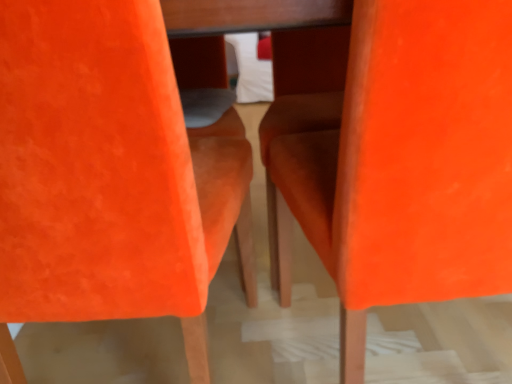
The width and height of the screenshot is (512, 384). I want to click on orange velvet chair at center, placed as the first chair when sorted from right to left, so (x=408, y=164).

What do you see at coordinates (408, 164) in the screenshot?
I see `orange velvet chair at center, arranged as the 2th chair when viewed from the left` at bounding box center [408, 164].

What do you see at coordinates (104, 175) in the screenshot? I see `orange suede chair at center, the 2th chair when ordered from right to left` at bounding box center [104, 175].

Locate an element on the screen. orange suede chair at center, the 2th chair when ordered from right to left is located at coordinates (104, 175).

I want to click on orange velvet chair at center, arranged as the 2th chair when viewed from the left, so click(408, 164).

Which is more to the right, orange velvet chair at center, placed as the first chair when sorted from right to left, or orange suede chair at center, which is counted as the 1th chair, starting from the left?

From the viewer's perspective, orange velvet chair at center, placed as the first chair when sorted from right to left, appears more on the right side.

Is orange velvet chair at center, placed as the first chair when sorted from right to left, positioned in front of orange suede chair at center, which is counted as the 1th chair, starting from the left?

No, it is not.

Considering the points (452, 64) and (177, 211), which point is in front, point (452, 64) or point (177, 211)?

The point (452, 64) is more forward.

From the image's perspective, does orange velvet chair at center, arranged as the 2th chair when viewed from the left, appear lower than orange suede chair at center, which is counted as the 1th chair, starting from the left?

No, from the image's perspective, orange velvet chair at center, arranged as the 2th chair when viewed from the left, is not below orange suede chair at center, which is counted as the 1th chair, starting from the left.

From a real-world perspective, is orange velvet chair at center, arranged as the 2th chair when viewed from the left, above or below orange suede chair at center, which is counted as the 1th chair, starting from the left?

In terms of real-world spatial position, orange velvet chair at center, arranged as the 2th chair when viewed from the left, is below orange suede chair at center, which is counted as the 1th chair, starting from the left.

Looking at their sizes, would you say orange velvet chair at center, placed as the first chair when sorted from right to left, is wider or thinner than orange suede chair at center, which is counted as the 1th chair, starting from the left?

In the image, orange velvet chair at center, placed as the first chair when sorted from right to left, appears to be more narrow than orange suede chair at center, which is counted as the 1th chair, starting from the left.

Is orange velvet chair at center, arranged as the 2th chair when viewed from the left, shorter than orange suede chair at center, which is counted as the 1th chair, starting from the left?

Correct, orange velvet chair at center, arranged as the 2th chair when viewed from the left, is not as tall as orange suede chair at center, which is counted as the 1th chair, starting from the left.

Who is bigger, orange velvet chair at center, arranged as the 2th chair when viewed from the left, or orange suede chair at center, which is counted as the 1th chair, starting from the left?

Bigger between the two is orange velvet chair at center, arranged as the 2th chair when viewed from the left.

Is orange velvet chair at center, placed as the first chair when sorted from right to left, outside of orange suede chair at center, the 2th chair when ordered from right to left?

Indeed, orange velvet chair at center, placed as the first chair when sorted from right to left, is completely outside orange suede chair at center, the 2th chair when ordered from right to left.

Are orange velvet chair at center, arranged as the 2th chair when viewed from the left, and orange suede chair at center, which is counted as the 1th chair, starting from the left, located far from each other?

orange velvet chair at center, arranged as the 2th chair when viewed from the left, is near orange suede chair at center, which is counted as the 1th chair, starting from the left, not far away.

Could you tell me if orange velvet chair at center, placed as the first chair when sorted from right to left, is turned towards orange suede chair at center, the 2th chair when ordered from right to left?

No, orange velvet chair at center, placed as the first chair when sorted from right to left, is not aimed at orange suede chair at center, the 2th chair when ordered from right to left.

How many degrees apart are the facing directions of orange velvet chair at center, placed as the first chair when sorted from right to left, and orange suede chair at center, which is counted as the 1th chair, starting from the left?

The angle between the facing direction of orange velvet chair at center, placed as the first chair when sorted from right to left, and the facing direction of orange suede chair at center, which is counted as the 1th chair, starting from the left, is 0.00073 degrees.

The image size is (512, 384). I want to click on chair behind the orange suede chair at center, the 2th chair when ordered from right to left, so click(x=408, y=164).

Which is more to the left, orange suede chair at center, which is counted as the 1th chair, starting from the left, or orange velvet chair at center, arranged as the 2th chair when viewed from the left?

From the viewer's perspective, orange suede chair at center, which is counted as the 1th chair, starting from the left, appears more on the left side.

Relative to orange velvet chair at center, arranged as the 2th chair when viewed from the left, is orange suede chair at center, which is counted as the 1th chair, starting from the left, in front or behind?

orange suede chair at center, which is counted as the 1th chair, starting from the left, is in front of orange velvet chair at center, arranged as the 2th chair when viewed from the left.

Does point (98, 132) lie in front of point (480, 146)?

That is True.

From the image's perspective, is orange suede chair at center, which is counted as the 1th chair, starting from the left, located beneath orange velvet chair at center, placed as the first chair when sorted from right to left?

Correct, orange suede chair at center, which is counted as the 1th chair, starting from the left, appears lower than orange velvet chair at center, placed as the first chair when sorted from right to left, in the image.

From a real-world perspective, is orange suede chair at center, the 2th chair when ordered from right to left, physically above orange velvet chair at center, arranged as the 2th chair when viewed from the left?

Yes, from a real-world perspective, orange suede chair at center, the 2th chair when ordered from right to left, is over orange velvet chair at center, arranged as the 2th chair when viewed from the left

Which of these two, orange suede chair at center, which is counted as the 1th chair, starting from the left, or orange velvet chair at center, arranged as the 2th chair when viewed from the left, is wider?

orange suede chair at center, which is counted as the 1th chair, starting from the left.

Does orange suede chair at center, the 2th chair when ordered from right to left, have a lesser height compared to orange velvet chair at center, arranged as the 2th chair when viewed from the left?

Incorrect, the height of orange suede chair at center, the 2th chair when ordered from right to left, does not fall short of that of orange velvet chair at center, arranged as the 2th chair when viewed from the left.

Does orange suede chair at center, which is counted as the 1th chair, starting from the left, have a smaller size compared to orange velvet chair at center, arranged as the 2th chair when viewed from the left?

Indeed, orange suede chair at center, which is counted as the 1th chair, starting from the left, has a smaller size compared to orange velvet chair at center, arranged as the 2th chair when viewed from the left.

Would you say orange suede chair at center, which is counted as the 1th chair, starting from the left, is inside or outside orange velvet chair at center, placed as the first chair when sorted from right to left?

orange suede chair at center, which is counted as the 1th chair, starting from the left, is spatially situated outside orange velvet chair at center, placed as the first chair when sorted from right to left.

Is orange suede chair at center, the 2th chair when ordered from right to left, not near orange velvet chair at center, arranged as the 2th chair when viewed from the left?

No, orange suede chair at center, the 2th chair when ordered from right to left, is in close proximity to orange velvet chair at center, arranged as the 2th chair when viewed from the left.

Is orange suede chair at center, the 2th chair when ordered from right to left, looking in the opposite direction of orange velvet chair at center, arranged as the 2th chair when viewed from the left?

No, orange suede chair at center, the 2th chair when ordered from right to left,'s orientation is not away from orange velvet chair at center, arranged as the 2th chair when viewed from the left.

How different are the orientations of orange suede chair at center, which is counted as the 1th chair, starting from the left, and orange velvet chair at center, arranged as the 2th chair when viewed from the left, in degrees?

The angle between the facing direction of orange suede chair at center, which is counted as the 1th chair, starting from the left, and the facing direction of orange velvet chair at center, arranged as the 2th chair when viewed from the left, is 0.00073 degrees.

The height and width of the screenshot is (384, 512). Identify the location of chair above the orange suede chair at center, the 2th chair when ordered from right to left (from the image's perspective). (408, 164).

I want to click on chair in front of the orange velvet chair at center, arranged as the 2th chair when viewed from the left, so tap(104, 175).

At what (x,y) coordinates should I click in order to perform the action: click on chair on the left side of orange velvet chair at center, placed as the first chair when sorted from right to left. Please return your answer as a coordinate pair (x, y). Looking at the image, I should click on (104, 175).